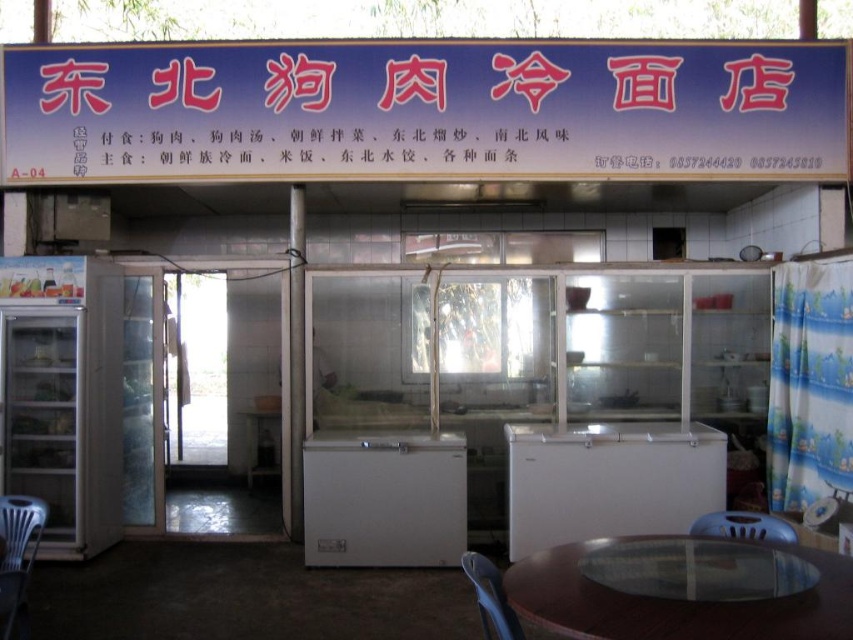
You are a customer entering the eatery and want to sit down. There is a white matte freezer at center and a blue plastic chair at lower center in your view. Which object should you approach first to sit?

You should approach the blue plastic chair at lower center first because the white matte freezer at center is further away from you than the blue plastic chair at lower center.

You are a customer entering the eatery and want to read the menu on the blue plastic sign at upper center. However, you are sitting on the blue plastic chair at lower center. Can you easily read the menu without moving from your seat?

The blue plastic sign at upper center is positioned over the blue plastic chair at lower center, so you can easily read the menu from your seat.